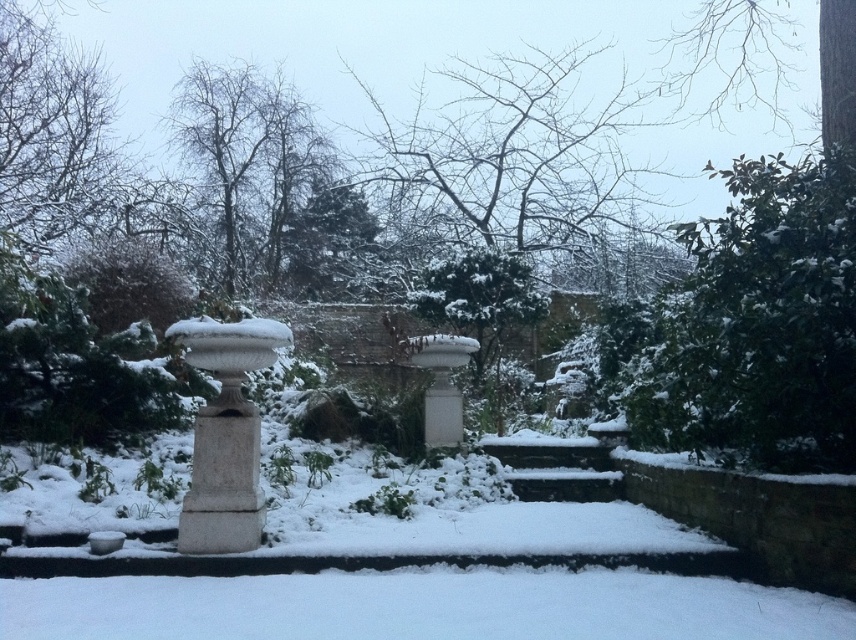
Does green leafy tree at upper right appear under white stone pillar at center?

No, green leafy tree at upper right is not below white stone pillar at center.

Where is `green leafy tree at upper right`? This screenshot has height=640, width=856. green leafy tree at upper right is located at coordinates (759, 324).

Is white stone urn at left taller than white stone pillar at center?

Yes, white stone urn at left is taller than white stone pillar at center.

Is white stone urn at left shorter than white stone pillar at center?

No, white stone urn at left is not shorter than white stone pillar at center.

Where is `white stone urn at left`? white stone urn at left is located at coordinates (224, 435).

Who is higher up, green leafy tree at upper right or white stone urn at left?

green leafy tree at upper right

Between green leafy tree at upper right and white stone urn at left, which one appears on the right side from the viewer's perspective?

A: From the viewer's perspective, green leafy tree at upper right appears more on the right side.

Describe the element at coordinates (759, 324) in the screenshot. I see `green leafy tree at upper right` at that location.

Image resolution: width=856 pixels, height=640 pixels. Find the location of `green leafy tree at upper right`. green leafy tree at upper right is located at coordinates (759, 324).